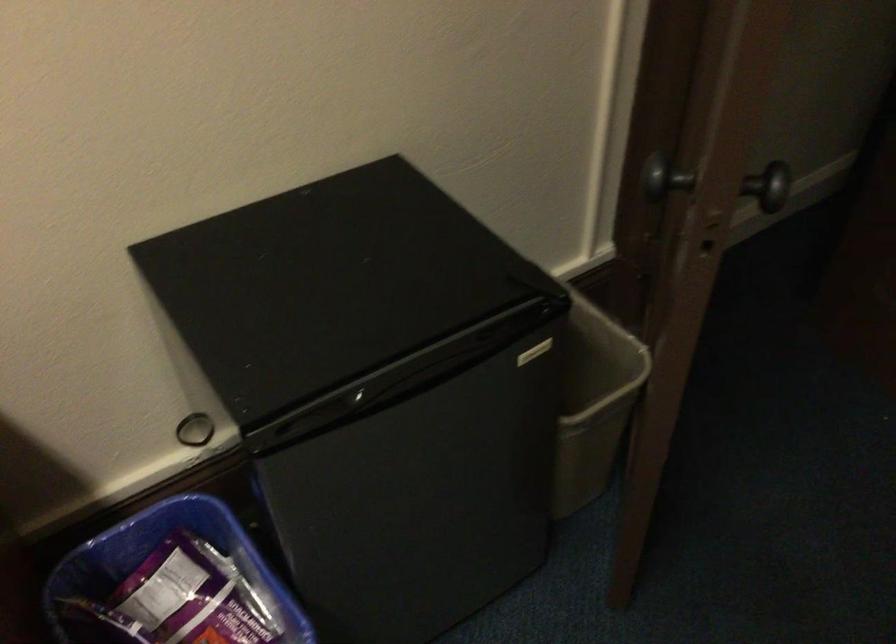
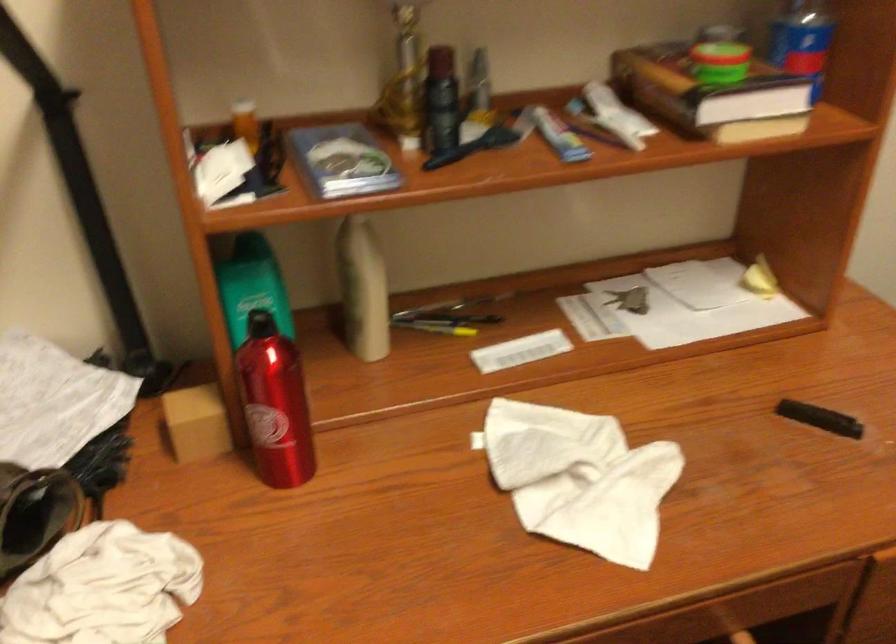
What movement of the cameraman would produce the second image?

The movement direction of the cameraman is left, backward.